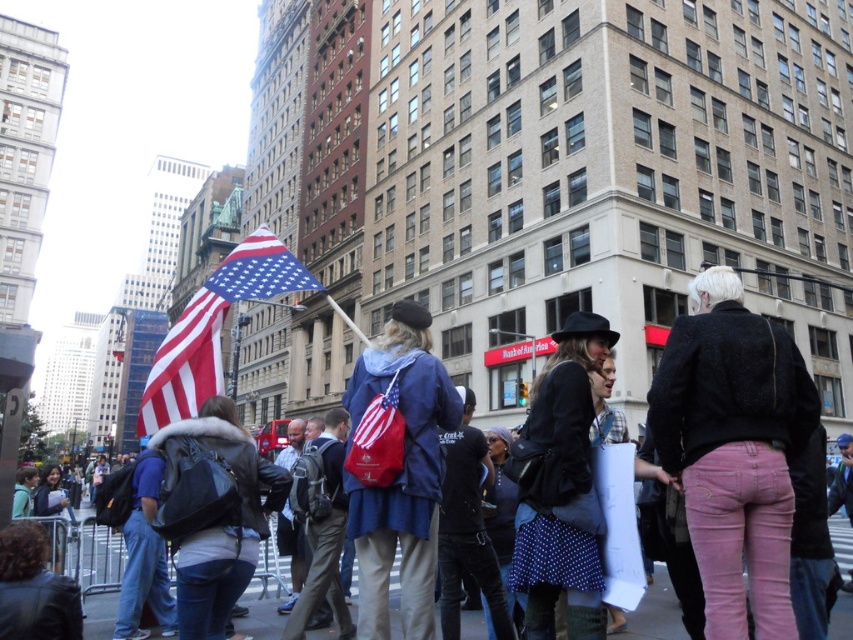
From the picture: Can you confirm if american flag at center is thinner than blue denim jacket at center?

Yes, american flag at center is thinner than blue denim jacket at center.

At what (x,y) coordinates should I click in order to perform the action: click on american flag at center. Please return your answer as a coordinate pair (x, y). Looking at the image, I should click on (213, 326).

Where is `american flag at center`? This screenshot has height=640, width=853. american flag at center is located at coordinates (213, 326).